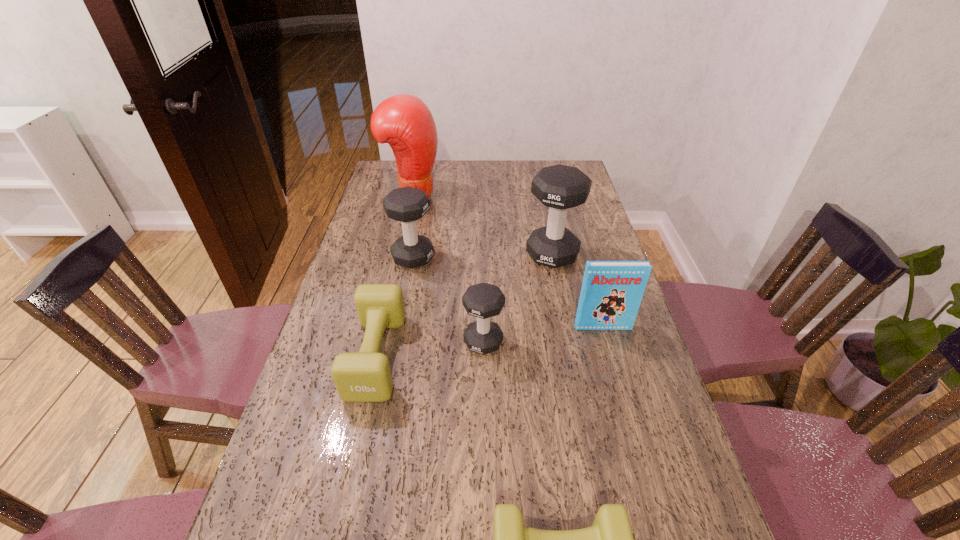
Where is `the farthest object`? the farthest object is located at coordinates (404, 121).

Where is `boxing glove`? The image size is (960, 540). boxing glove is located at coordinates (404, 121).

Find the location of `the biggest gray dumbbell`. the biggest gray dumbbell is located at coordinates (559, 187).

The height and width of the screenshot is (540, 960). Identify the location of the second tallest object. (559, 187).

Locate an element on the screen. the fourth shortest dumbbell is located at coordinates (407, 204).

Find the location of a particular element. This screenshot has width=960, height=540. the leftmost gray dumbbell is located at coordinates (407, 204).

Locate an element on the screen. The height and width of the screenshot is (540, 960). blue book is located at coordinates (612, 291).

Where is `the third shortest object`? The width and height of the screenshot is (960, 540). the third shortest object is located at coordinates (483, 300).

Find the location of `the smallest gray dumbbell`. the smallest gray dumbbell is located at coordinates (483, 300).

Where is `the farther olive dumbbell`? This screenshot has height=540, width=960. the farther olive dumbbell is located at coordinates (365, 376).